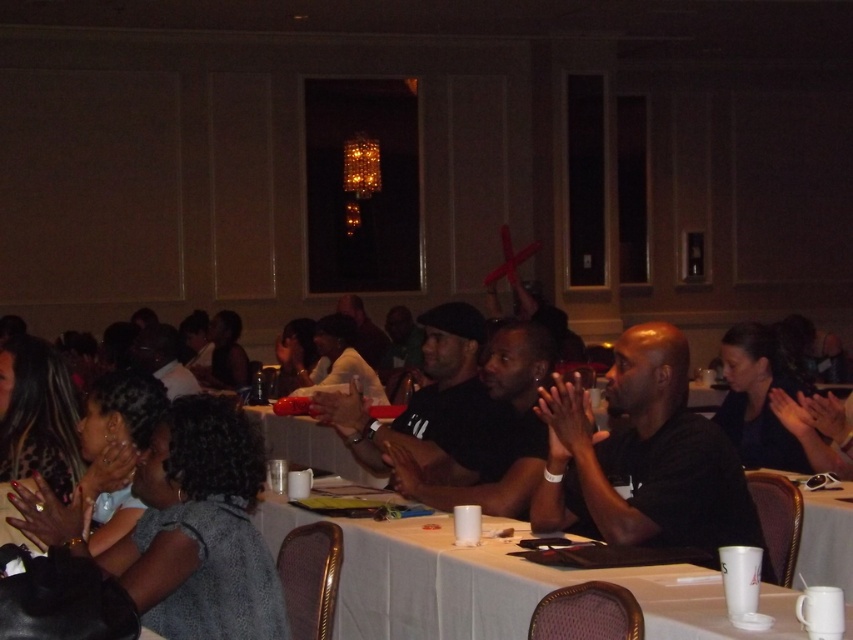
You are standing at the entrance of the conference room and see the point marked at coordinates (643, 458). What object is located at that specific point?

The black matte shirt at center is located at point (643, 458).

You are a photographer at the event and need to capture a clear photo of both the black matte shirt at center and the white paper cup at lower right. Which object should you focus on first to ensure both are in frame without needing to adjust the camera angle?

You should focus on the black matte shirt at center first because it is larger in size than the white paper cup at lower right, so capturing it first ensures the smaller object will also be in frame.

You are standing in the conference room and want to place a small decoration between the two points, point (621, 525) and point (374, 476). Which point is closer to you so you can start placing the decoration there?

Point (621, 525) is closer to the camera than point (374, 476), so you should start placing the decoration near point (621, 525) first.